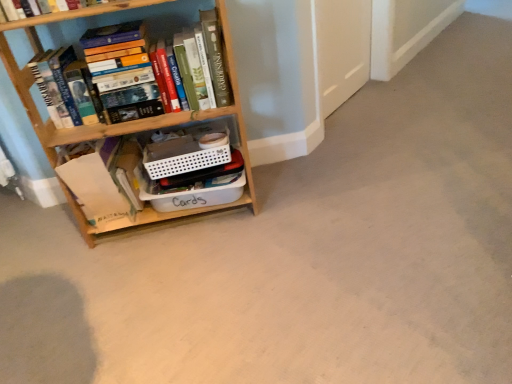
Locate an element on the screen. The height and width of the screenshot is (384, 512). vacant region to the right of wooden bookcase at left is located at coordinates (296, 205).